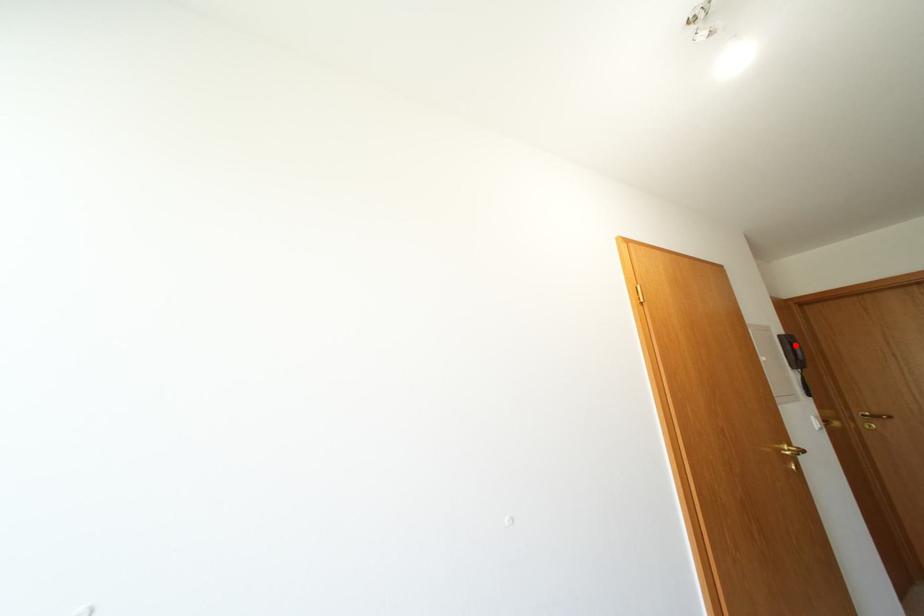
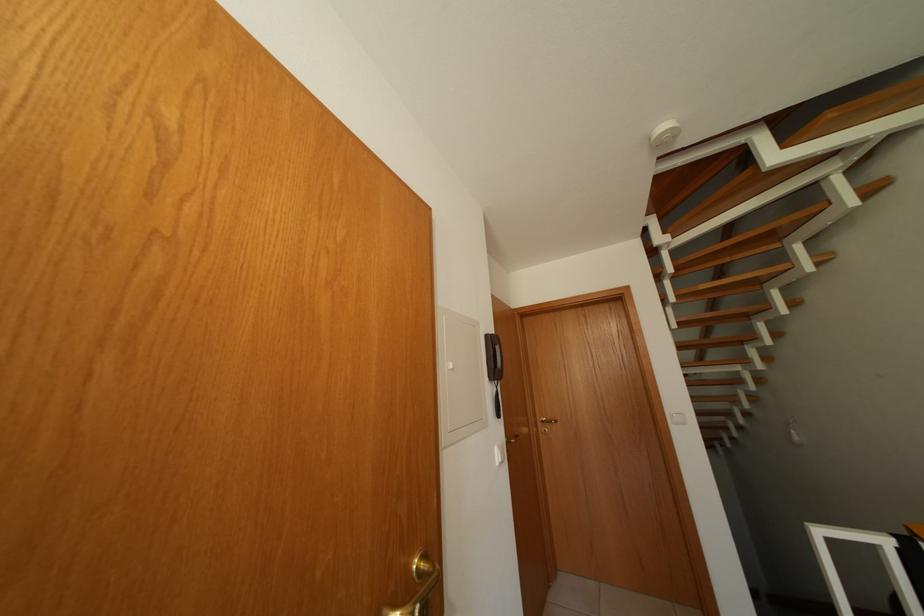
The point at the highlighted location is marked in the first image. Where is the corresponding point in the second image?

(500, 346)